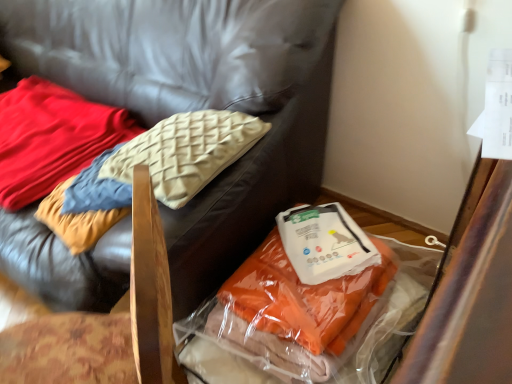
Question: Is soft cream pillow at upper left facing away from white plastic kit at lower right?

Choices:
 (A) yes
 (B) no

Answer: (B)

Question: Is soft cream pillow at upper left not near white plastic kit at lower right?

Choices:
 (A) yes
 (B) no

Answer: (B)

Question: From the image's perspective, is soft cream pillow at upper left located beneath white plastic kit at lower right?

Choices:
 (A) yes
 (B) no

Answer: (B)

Question: From a real-world perspective, does soft cream pillow at upper left stand above white plastic kit at lower right?

Choices:
 (A) yes
 (B) no

Answer: (A)

Question: Considering the relative sizes of soft cream pillow at upper left and white plastic kit at lower right in the image provided, is soft cream pillow at upper left thinner than white plastic kit at lower right?

Choices:
 (A) no
 (B) yes

Answer: (A)

Question: Would you say soft cream pillow at upper left contains white plastic kit at lower right?

Choices:
 (A) no
 (B) yes

Answer: (A)

Question: Is soft cream pillow at upper left positioned far away from velvet cushion at upper left, which is the 1th furniture from right to left?

Choices:
 (A) yes
 (B) no

Answer: (B)

Question: From a real-world perspective, is soft cream pillow at upper left positioned under velvet cushion at upper left, which is the 1th furniture from right to left, based on gravity?

Choices:
 (A) no
 (B) yes

Answer: (B)

Question: Does soft cream pillow at upper left have a greater height compared to velvet cushion at upper left, the 2th furniture viewed from the left?

Choices:
 (A) yes
 (B) no

Answer: (B)

Question: Is soft cream pillow at upper left facing away from velvet cushion at upper left, which is the 1th furniture from right to left?

Choices:
 (A) yes
 (B) no

Answer: (B)

Question: Is soft cream pillow at upper left bigger than velvet cushion at upper left, the 2th furniture viewed from the left?

Choices:
 (A) no
 (B) yes

Answer: (A)

Question: Is soft cream pillow at upper left further to the viewer compared to velvet cushion at upper left, which is the 1th furniture from right to left?

Choices:
 (A) yes
 (B) no

Answer: (A)

Question: Is white plastic kit at lower right at the left side of translucent plastic bag at lower right, the 2th furniture when ordered from right to left?

Choices:
 (A) yes
 (B) no

Answer: (B)